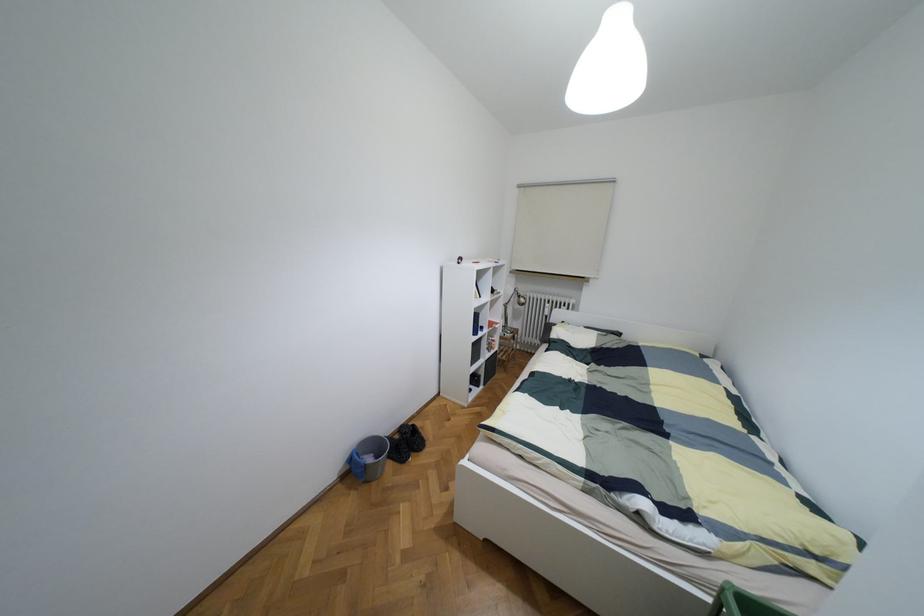
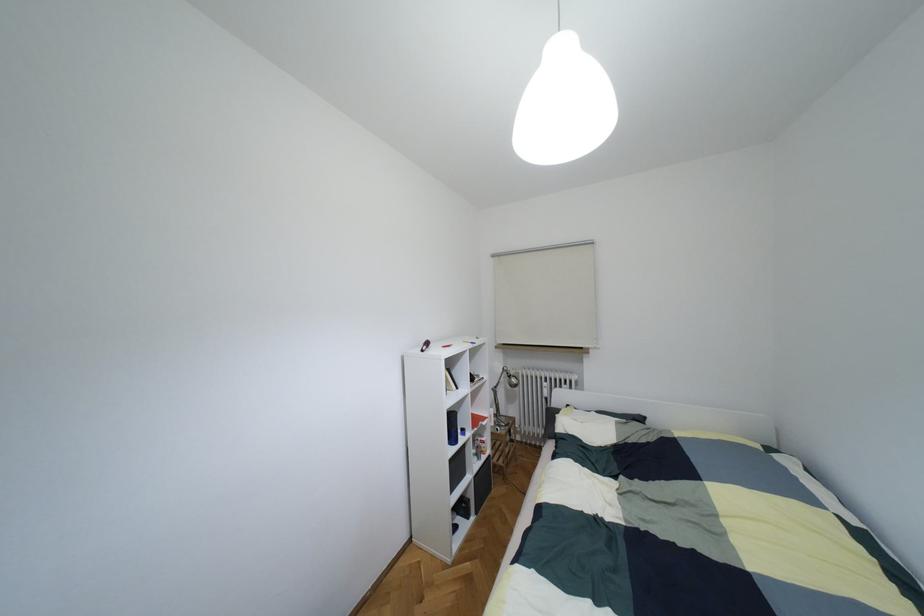
Question: The first image is from the beginning of the video and the second image is from the end. How did the camera likely rotate when shooting the video?

Choices:
 (A) Left
 (B) Right
 (C) Up
 (D) Down

Answer: (C)